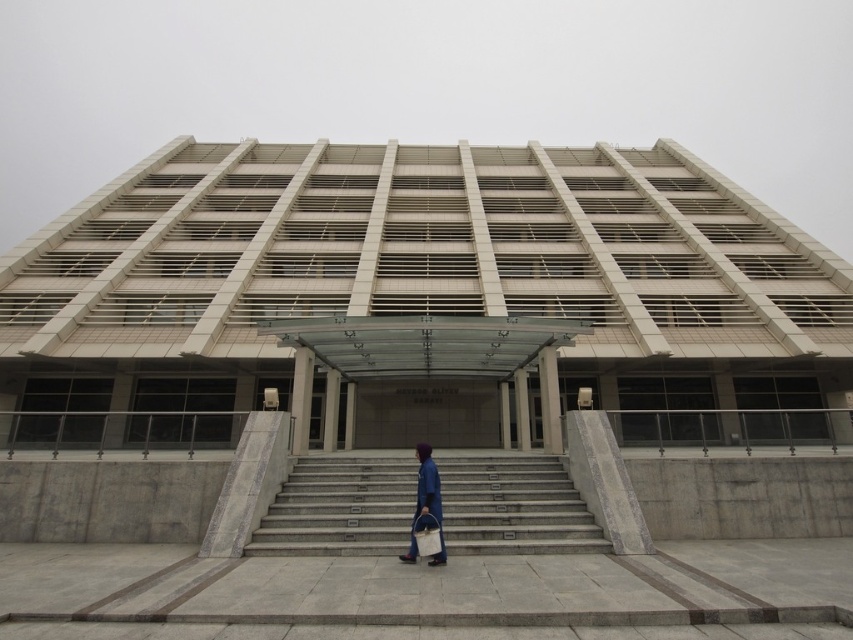
Question: Which object appears closest to the camera in this image?

Choices:
 (A) blue fabric bag at center
 (B) gray concrete stairs at center

Answer: (A)

Question: Can you confirm if gray concrete stairs at center is wider than blue fabric bag at center?

Choices:
 (A) yes
 (B) no

Answer: (A)

Question: Considering the relative positions of gray concrete stairs at center and blue fabric bag at center in the image provided, where is gray concrete stairs at center located with respect to blue fabric bag at center?

Choices:
 (A) above
 (B) below

Answer: (B)

Question: Does gray concrete stairs at center appear on the right side of blue fabric bag at center?

Choices:
 (A) yes
 (B) no

Answer: (A)